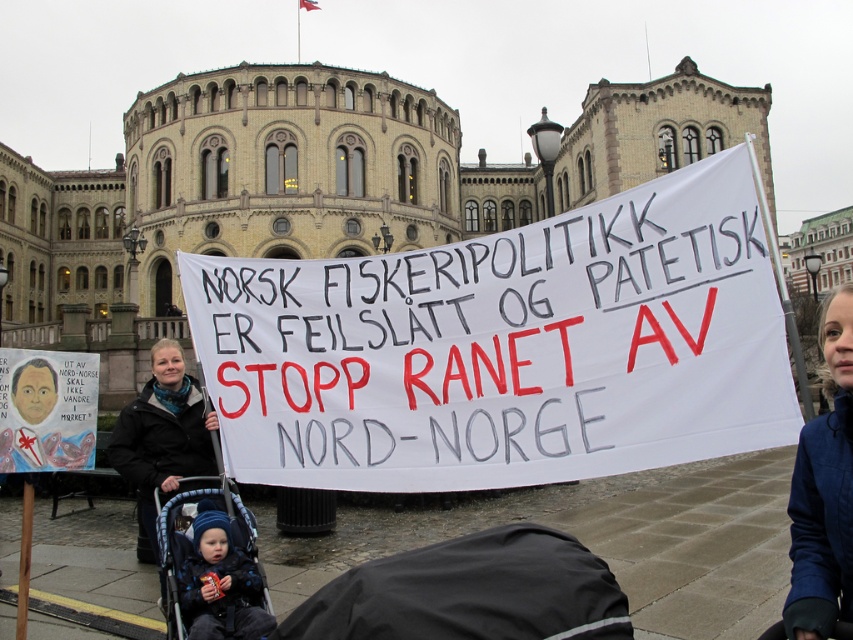
Question: Is blue fleece jacket at lower right to the left of black jacket at center from the viewer's perspective?

Choices:
 (A) yes
 (B) no

Answer: (B)

Question: Considering the real-world distances, which object is farthest from the blue fleece jacket at lower right?

Choices:
 (A) blue fleece hat at lower left
 (B) white paper banner at center
 (C) black jacket at center

Answer: (C)

Question: Is black jacket at center below blue fleece hat at lower left?

Choices:
 (A) yes
 (B) no

Answer: (B)

Question: Is blue fleece jacket at lower right thinner than blue fleece hat at lower left?

Choices:
 (A) yes
 (B) no

Answer: (B)

Question: Which point appears closest to the camera in this image?

Choices:
 (A) (567, 406)
 (B) (178, 476)
 (C) (213, 586)
 (D) (808, 636)

Answer: (D)

Question: Among these objects, which one is nearest to the camera?

Choices:
 (A) white paper banner at center
 (B) black jacket at center
 (C) blue fleece jacket at lower right
 (D) blue fleece hat at lower left

Answer: (C)